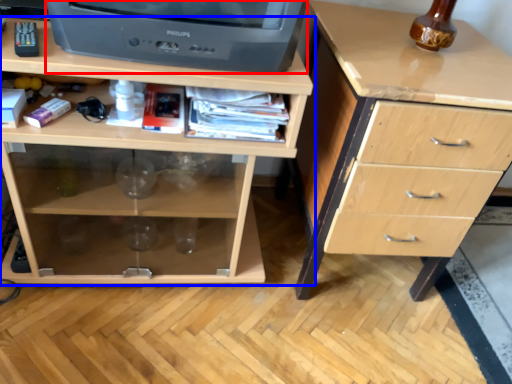
Question: Which object is further to the camera taking this photo, television (highlighted by a red box) or chest of drawers (highlighted by a blue box)?

Choices:
 (A) television
 (B) chest of drawers

Answer: (B)